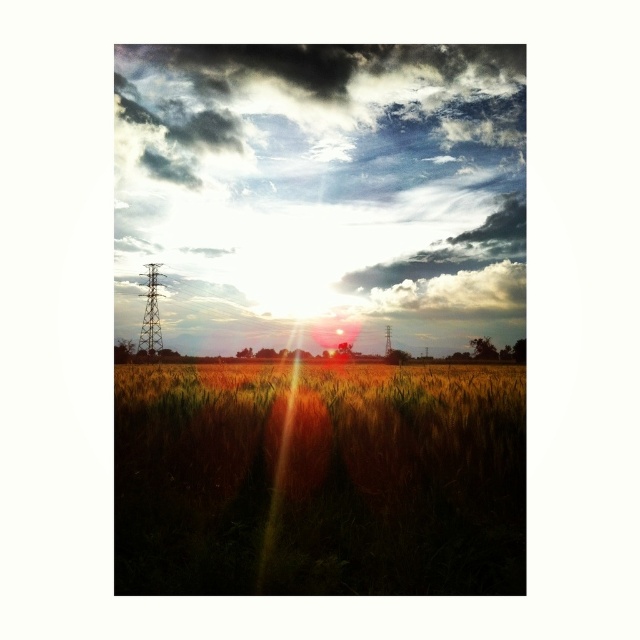
Does cloudy sky at upper center have a lesser height compared to golden grass at center?

No.

Measure the distance between point (308, 166) and camera.

The distance of point (308, 166) from camera is 37.16 meters.

I want to click on cloudy sky at upper center, so click(x=321, y=195).